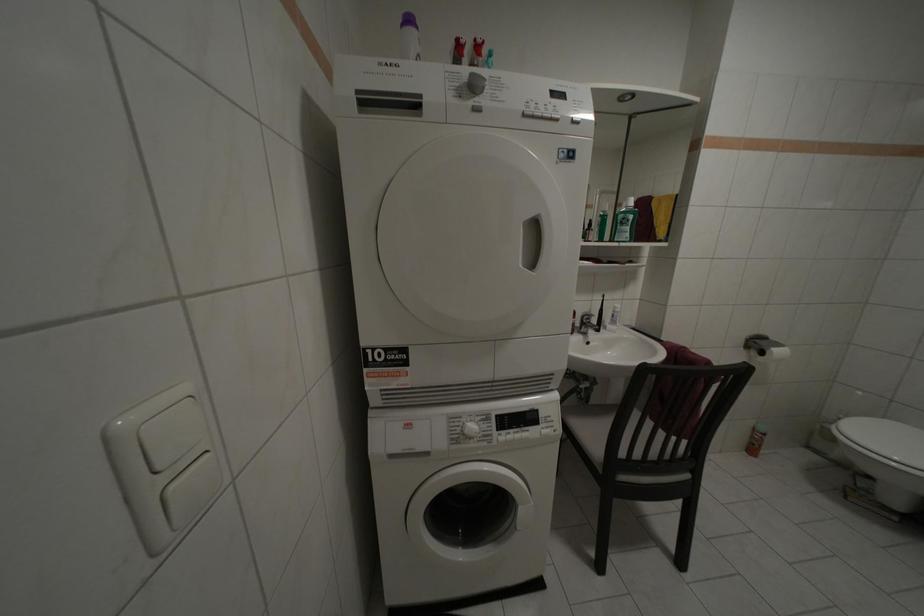
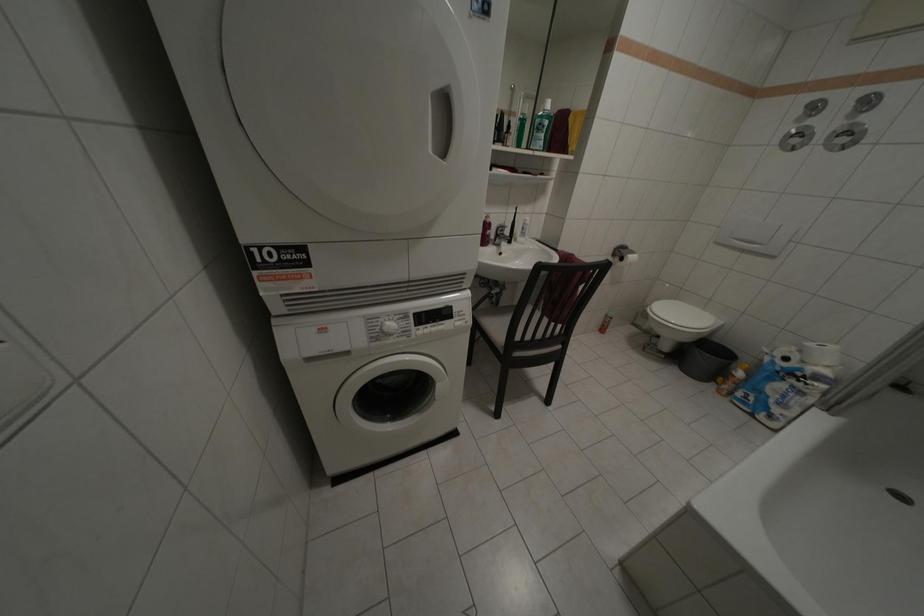
In a continuous first-person perspective shot, in which direction is the camera moving?

A: The cameraman moved toward right, backward.